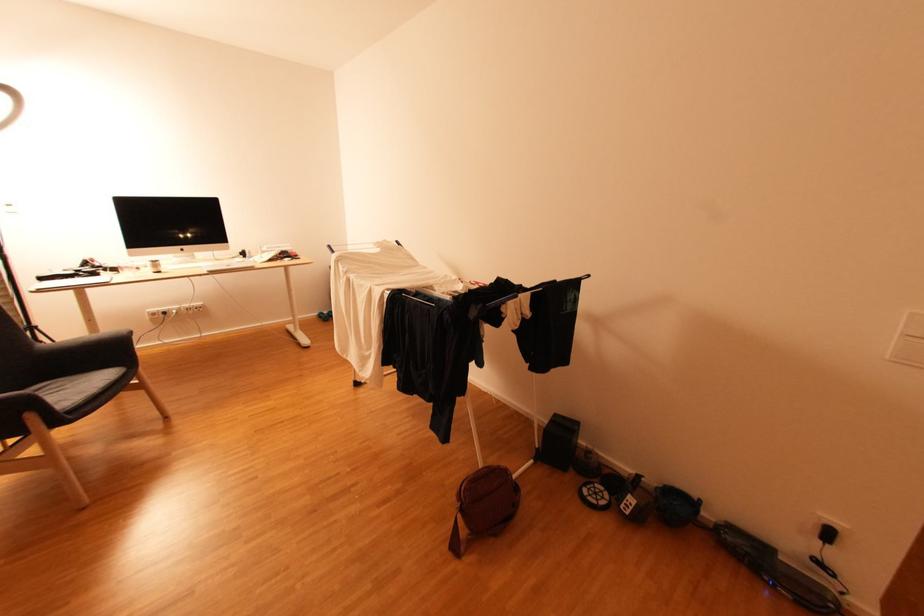
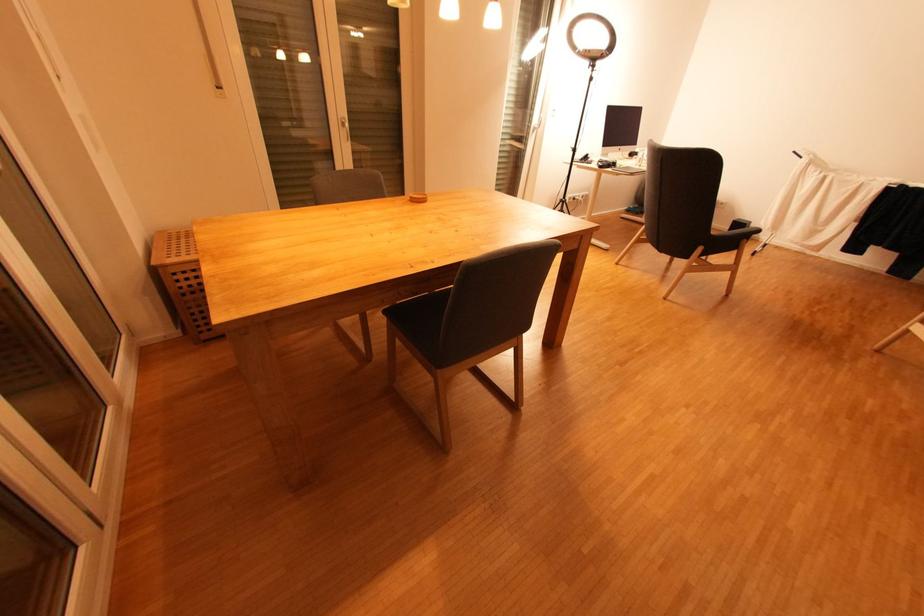
The images are taken continuously from a first-person perspective. In which direction are you moving?

The movement direction of the cameraman is left, backward.